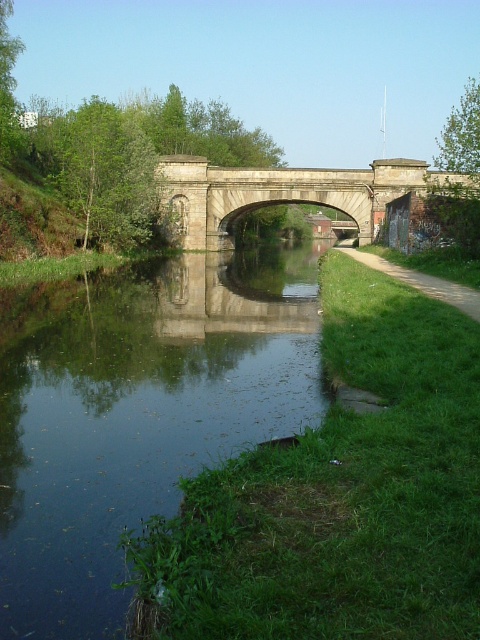
Who is shorter, green reflective water at center or stone bridge at center?

With less height is green reflective water at center.

Based on the photo, does green reflective water at center appear over stone bridge at center?

No, green reflective water at center is not above stone bridge at center.

Between point (25, 536) and point (297, 168), which one is positioned in front?

Positioned in front is point (25, 536).

Locate an element on the screen. The height and width of the screenshot is (640, 480). green reflective water at center is located at coordinates (141, 417).

Is green reflective water at center smaller than green grassy path at right?

No.

Who is shorter, green reflective water at center or green grassy path at right?

green grassy path at right

Which is behind, point (240, 390) or point (373, 262)?

Point (373, 262)

Identify the location of green reflective water at center. The height and width of the screenshot is (640, 480). (141, 417).

Can you confirm if stone bridge at center is positioned to the left of green grassy path at right?

Indeed, stone bridge at center is positioned on the left side of green grassy path at right.

Which is in front, point (350, 196) or point (384, 264)?

Point (384, 264) is in front.

This screenshot has height=640, width=480. What are the coordinates of `stone bridge at center` in the screenshot? It's located at (284, 193).